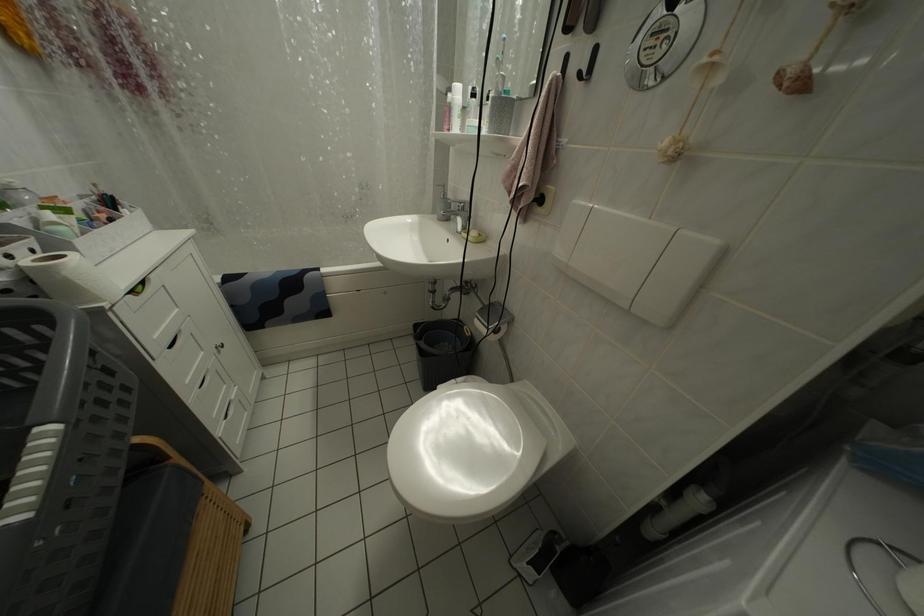
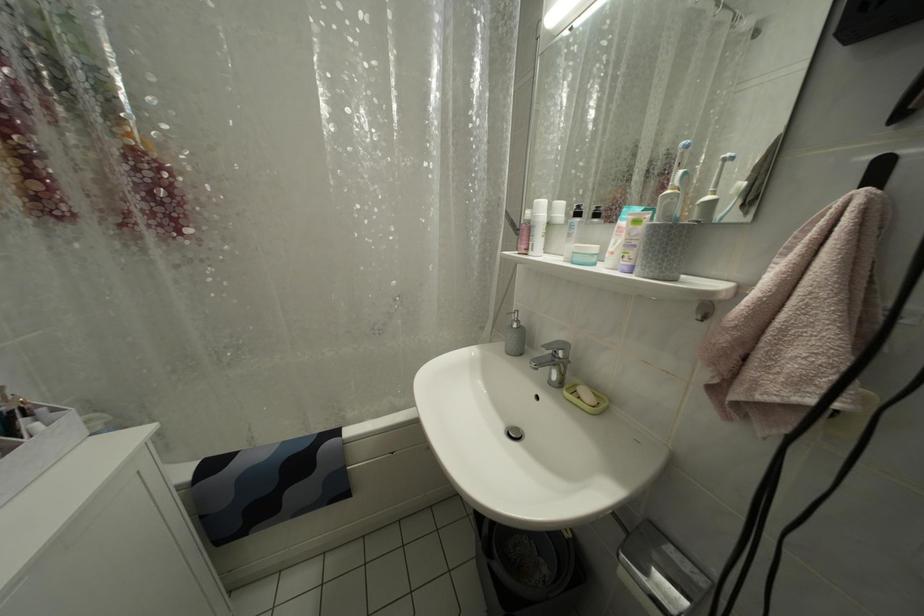
Question: The first image is from the beginning of the video and the second image is from the end. How did the camera likely rotate when shooting the video?

Choices:
 (A) Left
 (B) Right
 (C) Up
 (D) Down

Answer: (C)